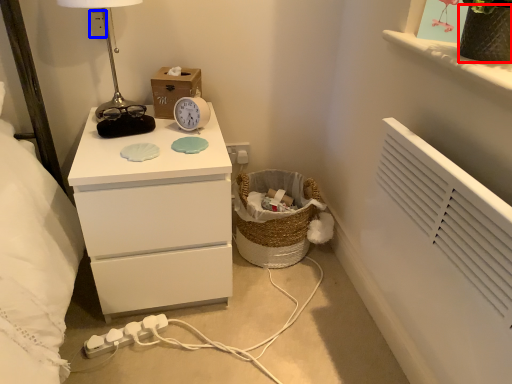
Question: Which object is further to the camera taking this photo, vase (highlighted by a red box) or electric outlet (highlighted by a blue box)?

Choices:
 (A) vase
 (B) electric outlet

Answer: (B)